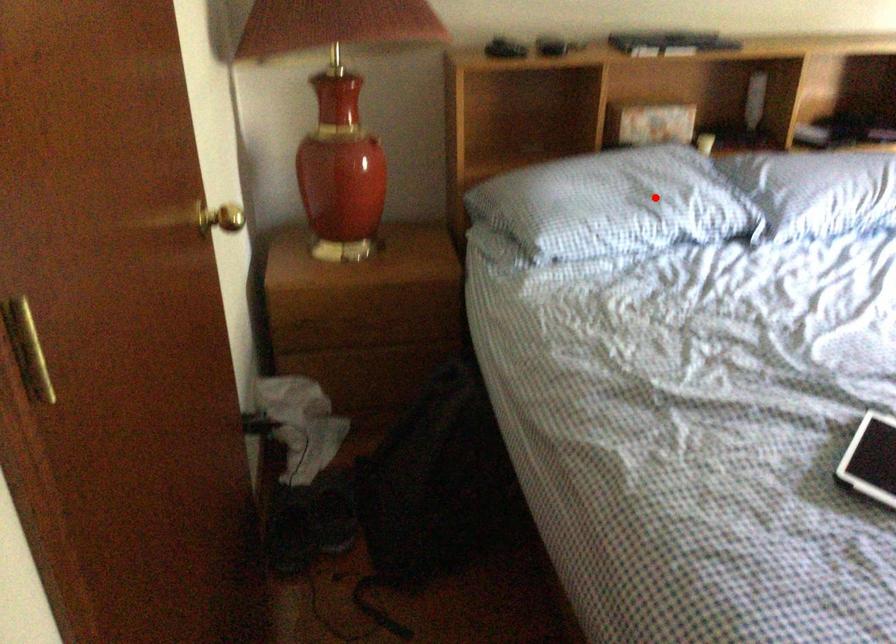
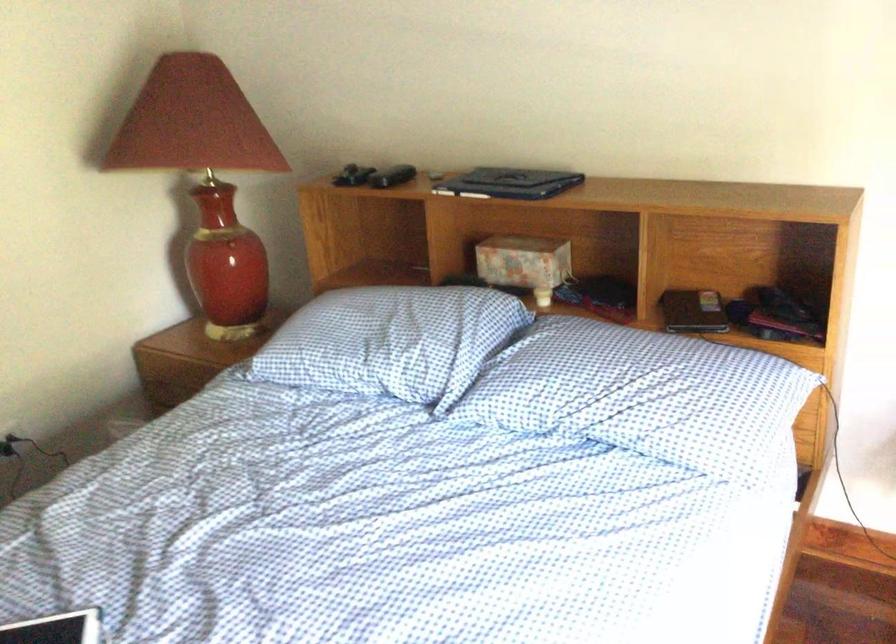
Where in the second image is the point corresponding to the highlighted location from the first image?

(384, 342)